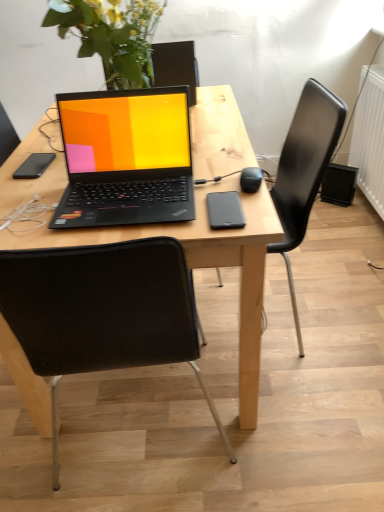
Find the location of a particular element. vacant space that is to the left of black matte computer mouse at center-right is located at coordinates (200, 188).